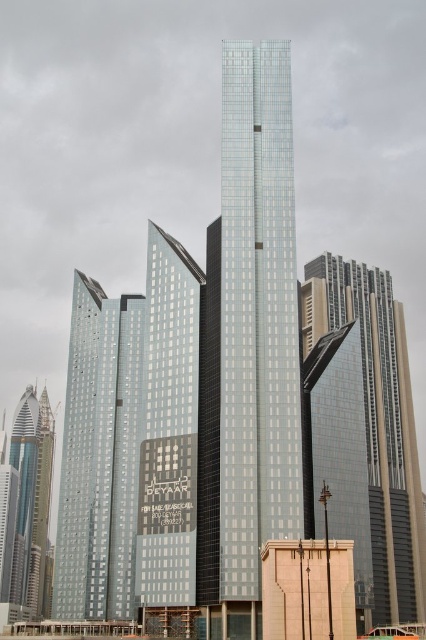
Can you confirm if glassy metallic skyscraper at center is bigger than shiny silver skyscraper at left?

Actually, glassy metallic skyscraper at center might be smaller than shiny silver skyscraper at left.

Locate an element on the screen. Image resolution: width=426 pixels, height=640 pixels. glassy metallic skyscraper at center is located at coordinates (377, 422).

Image resolution: width=426 pixels, height=640 pixels. I want to click on glassy metallic skyscraper at center, so click(377, 422).

Is glassy steel skyscraper at center in front of shiny silver skyscraper at left?

Yes, it is in front of shiny silver skyscraper at left.

The image size is (426, 640). What do you see at coordinates (250, 333) in the screenshot?
I see `glassy steel skyscraper at center` at bounding box center [250, 333].

The height and width of the screenshot is (640, 426). In order to click on glassy steel skyscraper at center in this screenshot , I will do `click(250, 333)`.

From the picture: Who is positioned more to the left, glassy steel skyscraper at center or metallic glass skyscraper at left?

From the viewer's perspective, metallic glass skyscraper at left appears more on the left side.

At what (x,y) coordinates should I click in order to perform the action: click on glassy steel skyscraper at center. Please return your answer as a coordinate pair (x, y). Looking at the image, I should click on (250, 333).

Locate an element on the screen. glassy steel skyscraper at center is located at coordinates (250, 333).